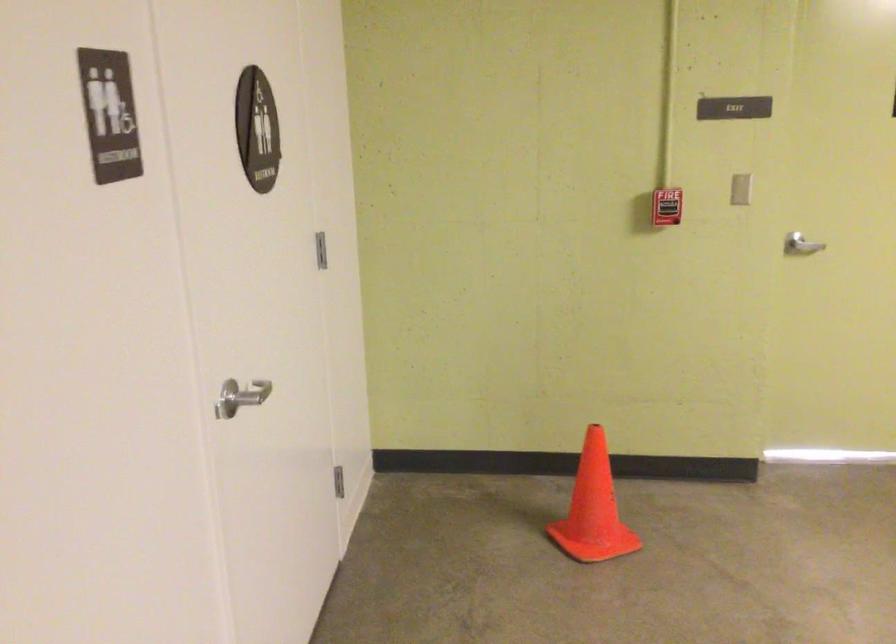
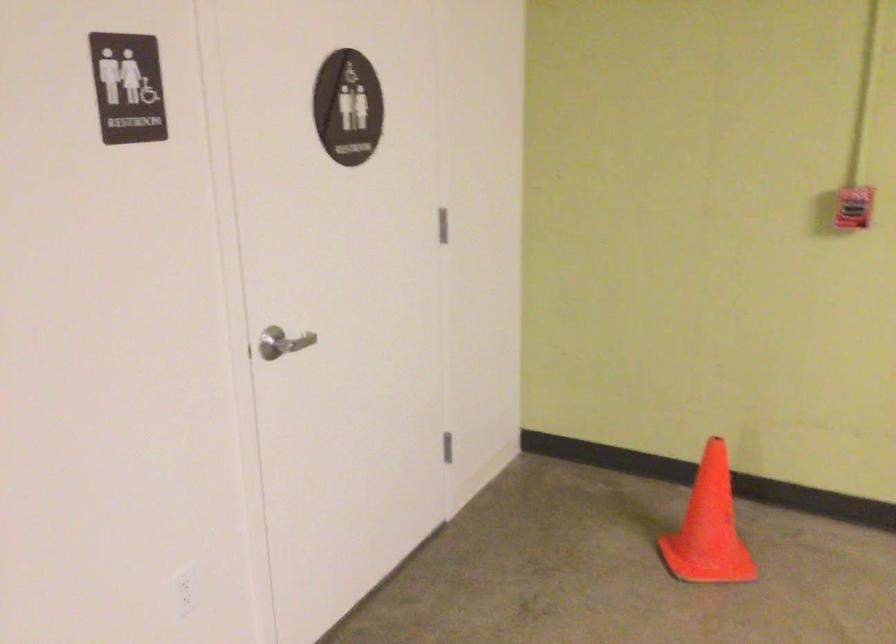
Locate, in the second image, the point that corresponds to point 599,506 in the first image.

(709, 527)